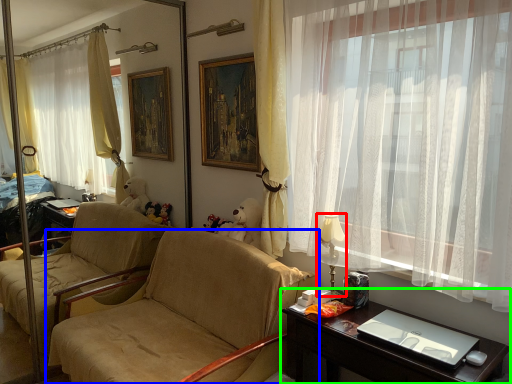
Question: Based on their relative distances, which object is nearer to lamp (highlighted by a red box)? Choose from chair (highlighted by a blue box) and desk (highlighted by a green box).

Choices:
 (A) chair
 (B) desk

Answer: (B)